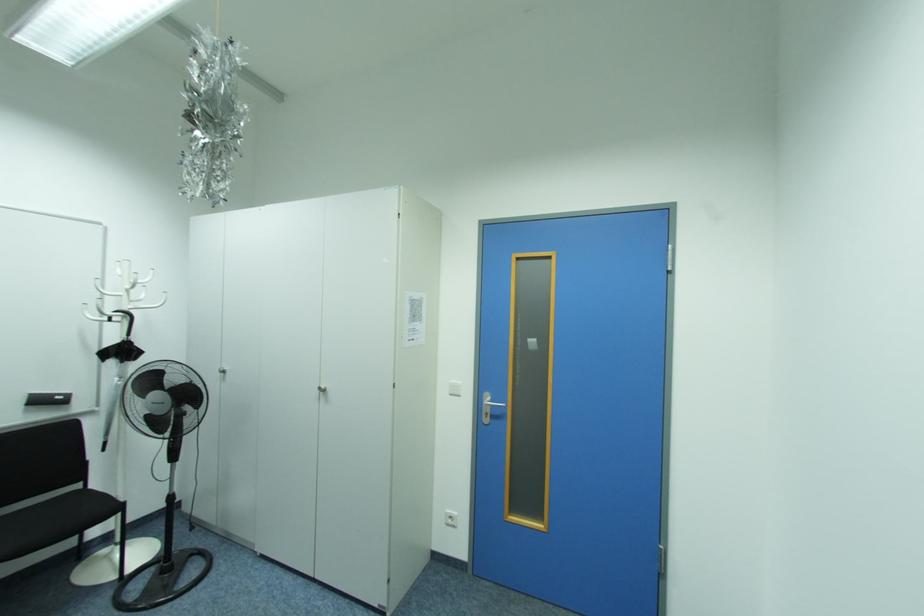
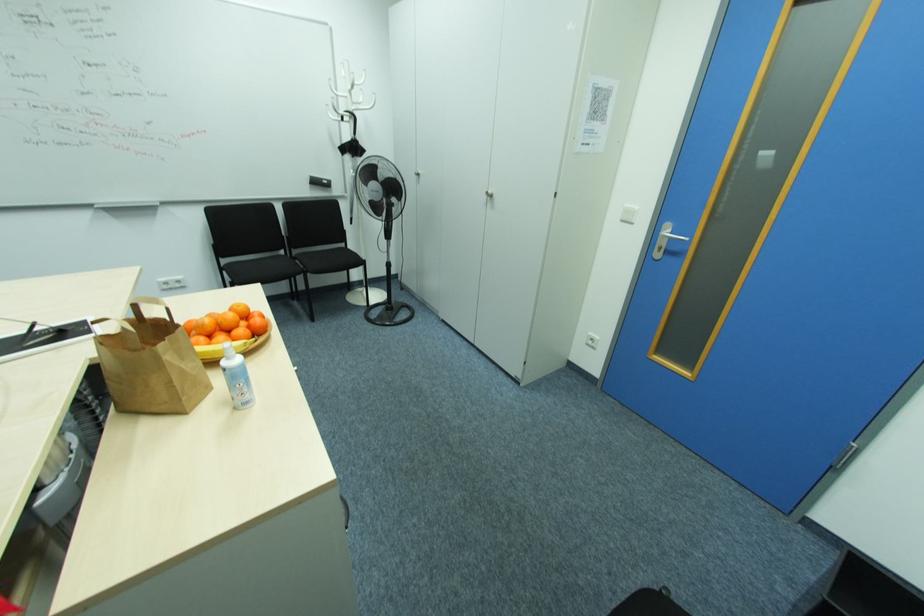
In the scene shown: The first image is from the beginning of the video and the second image is from the end. How did the camera likely rotate when shooting the video?

The camera's rotation is toward left-down.